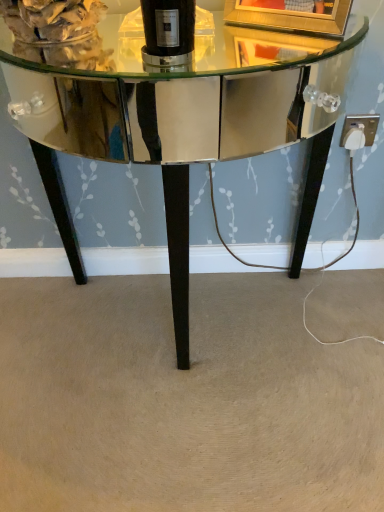
Question: From a real-world perspective, is shiny mirrored table at center above or below black glass bottle at center?

Choices:
 (A) above
 (B) below

Answer: (B)

Question: In terms of size, does shiny mirrored table at center appear bigger or smaller than black glass bottle at center?

Choices:
 (A) big
 (B) small

Answer: (A)

Question: Estimate the real-world distances between objects in this image. Which object is farther from the gold metallic picture frame at upper center?

Choices:
 (A) shiny mirrored table at center
 (B) black glass bottle at center
 (C) white plastic outlet at lower right

Answer: (A)

Question: Estimate the real-world distances between objects in this image. Which object is farther from the black glass bottle at center?

Choices:
 (A) white plastic outlet at lower right
 (B) gold metallic picture frame at upper center
 (C) shiny mirrored table at center

Answer: (C)